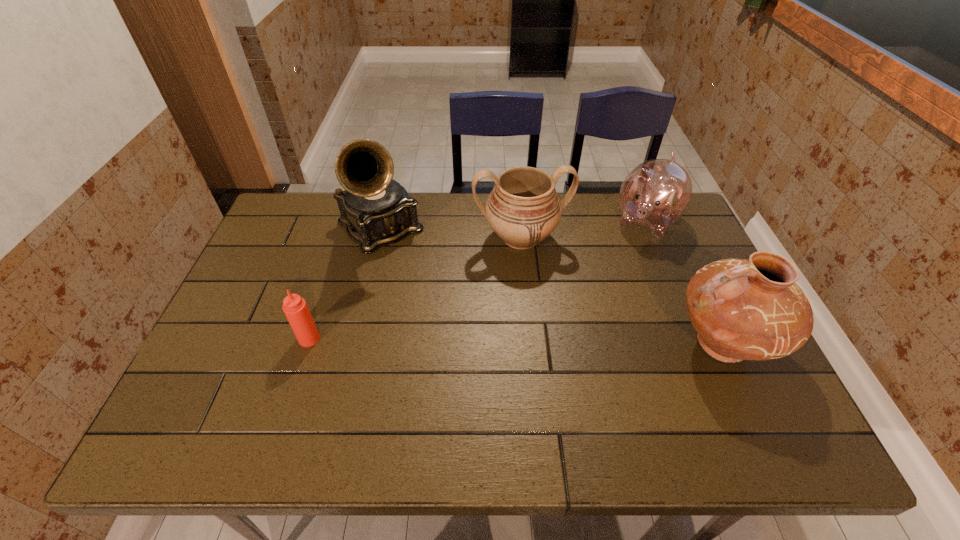
At what (x,y) coordinates should I click in order to perform the action: click on free location located on the front-facing side of the third object from left to right. Please return your answer as a coordinate pair (x, y). This screenshot has width=960, height=540. Looking at the image, I should click on (548, 336).

Find the location of `vacant area situated 0.140m on the front-facing side of the third object from left to right`. vacant area situated 0.140m on the front-facing side of the third object from left to right is located at coordinates (538, 298).

The image size is (960, 540). What are the coordinates of `vacant space located on the front facing side of the piggy bank` in the screenshot? It's located at (583, 322).

Where is `free location located 0.300m on the front facing side of the piggy bank`? The height and width of the screenshot is (540, 960). free location located 0.300m on the front facing side of the piggy bank is located at coordinates (596, 300).

Locate an element on the screen. blank space located 0.400m on the front facing side of the piggy bank is located at coordinates (581, 325).

The image size is (960, 540). Find the location of `free space located 0.130m on the horn of the phonograph record`. free space located 0.130m on the horn of the phonograph record is located at coordinates (x=423, y=281).

Locate an element on the screen. The height and width of the screenshot is (540, 960). free spot located 0.200m on the horn of the phonograph record is located at coordinates 437,295.

Locate an element on the screen. This screenshot has width=960, height=540. vacant space positioned 0.360m on the horn of the phonograph record is located at coordinates click(x=469, y=334).

The height and width of the screenshot is (540, 960). Identify the location of urn located at the far edge. (523, 209).

Where is `piggy bank positioned at the far edge`? piggy bank positioned at the far edge is located at coordinates (655, 194).